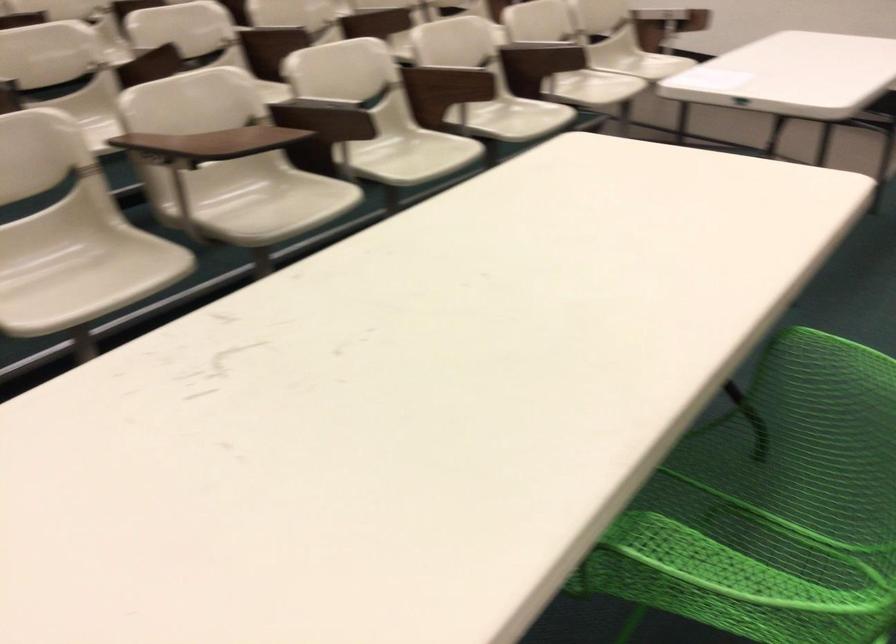
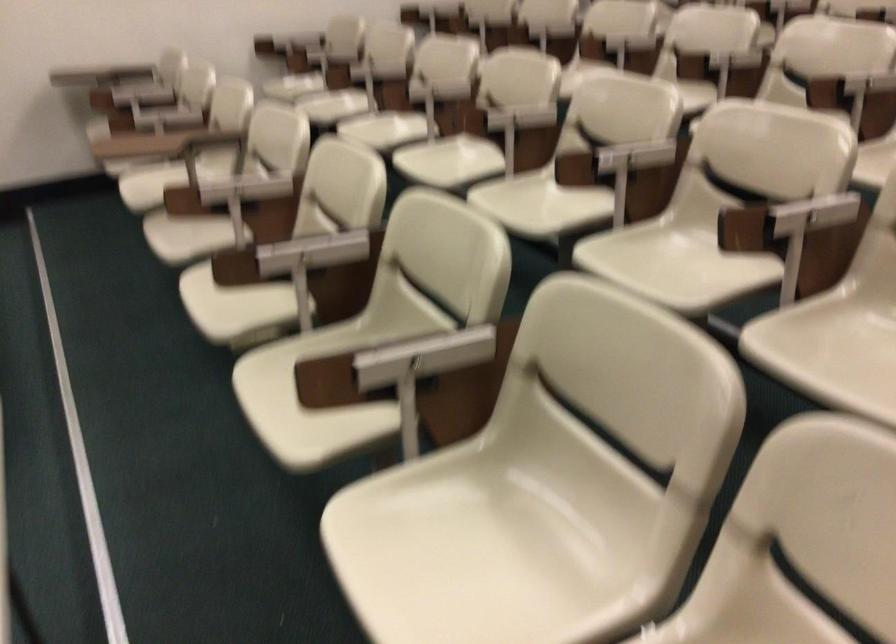
The point at (358, 104) is marked in the first image. Where is the corresponding point in the second image?

(229, 191)